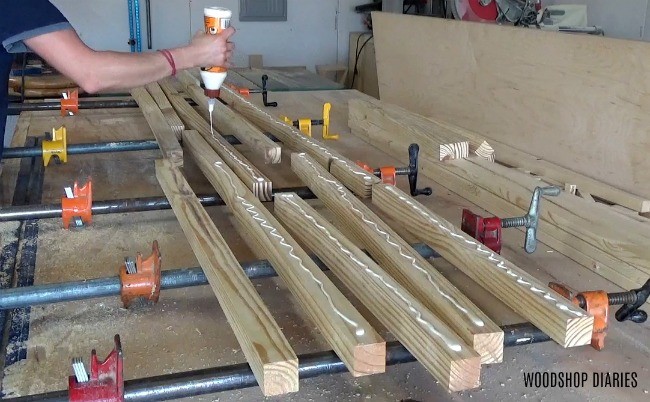
Locate an element on the screen. The image size is (650, 402). glue bottle is located at coordinates (210, 76).